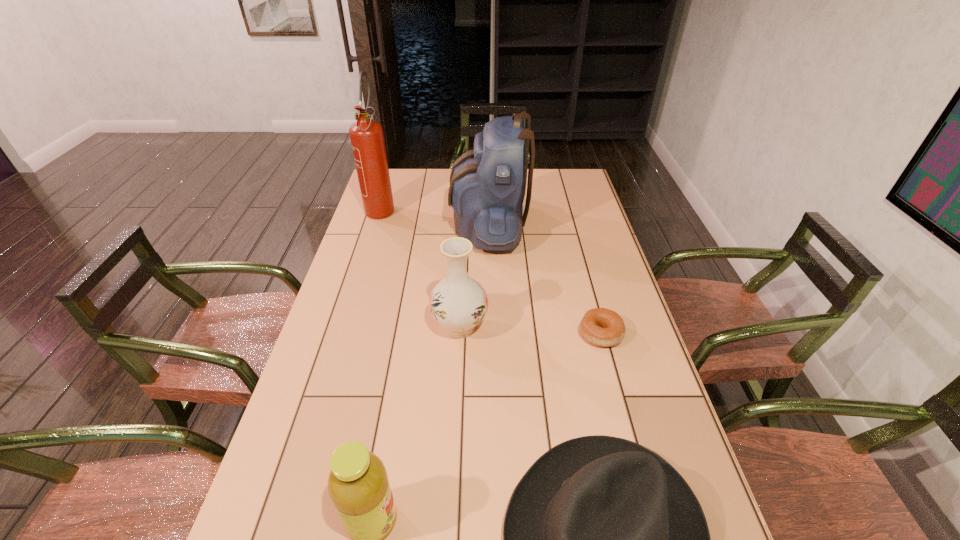
Image resolution: width=960 pixels, height=540 pixels. Find the location of `the tallest object`. the tallest object is located at coordinates (367, 139).

The image size is (960, 540). Identify the location of fire extinguisher. (367, 139).

At what (x,y) coordinates should I click in order to perform the action: click on the fifth shortest object. Please return your answer as a coordinate pair (x, y). The height and width of the screenshot is (540, 960). Looking at the image, I should click on (487, 188).

At what (x,y) coordinates should I click in order to perform the action: click on vase. Please return your answer as a coordinate pair (x, y). The height and width of the screenshot is (540, 960). Looking at the image, I should click on (458, 303).

The image size is (960, 540). Identify the location of the shortest object. (602, 327).

At what (x,y) coordinates should I click in order to perform the action: click on vacant region located 0.260m from the nozzle of the tallest object. Please return your answer as a coordinate pair (x, y). This screenshot has width=960, height=540. Looking at the image, I should click on (362, 269).

Where is `vacant point located 0.270m at the front pocket of the second tallest object`? Image resolution: width=960 pixels, height=540 pixels. vacant point located 0.270m at the front pocket of the second tallest object is located at coordinates (377, 225).

At what (x,y) coordinates should I click in order to perform the action: click on blank space located 0.060m at the front pocket of the second tallest object. Please return your answer as a coordinate pair (x, y). The image size is (960, 540). Looking at the image, I should click on (434, 225).

The image size is (960, 540). Find the location of `vacant space located 0.200m at the front pocket of the second tallest object`. vacant space located 0.200m at the front pocket of the second tallest object is located at coordinates (396, 225).

The height and width of the screenshot is (540, 960). In order to click on vacant space located 0.120m on the right of the vase in this screenshot , I will do `click(531, 327)`.